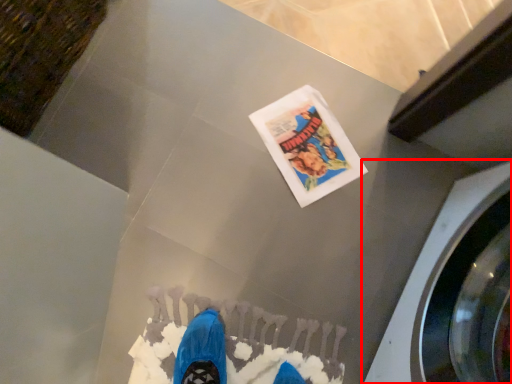
Question: From the image, what is the correct spatial relationship of washing machine (annotated by the red box) in relation to flyer?

Choices:
 (A) left
 (B) right

Answer: (B)